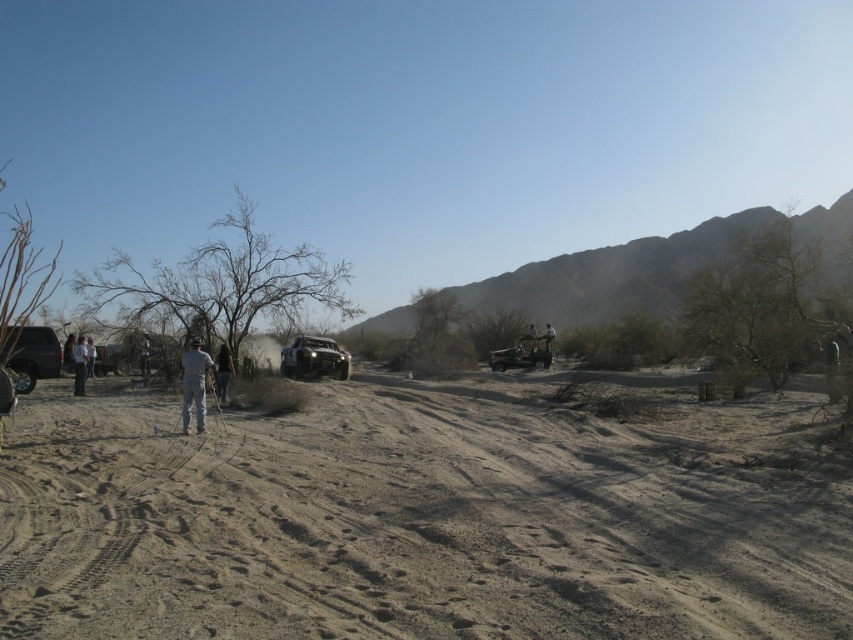
Question: Does gray fabric pants at left appear on the right side of white fabric pants at center?

Choices:
 (A) no
 (B) yes

Answer: (A)

Question: Estimate the real-world distances between objects in this image. Which object is farther from the dull brown dirt at center?

Choices:
 (A) matte silver jeep at center
 (B) green fabric shirt at right
 (C) gray cotton shirt at center

Answer: (A)

Question: Which object is farther from the camera taking this photo?

Choices:
 (A) dull brown dirt at center
 (B) white fabric camera at center
 (C) gray cotton shirt at center
 (D) green fabric shirt at right

Answer: (B)

Question: Is the position of dull brown dirt at center more distant than that of matte black truck at left?

Choices:
 (A) no
 (B) yes

Answer: (A)

Question: Is matte black truck at left to the left of light blue jeans at center from the viewer's perspective?

Choices:
 (A) yes
 (B) no

Answer: (A)

Question: Which of the following is the closest to the observer?

Choices:
 (A) matte black truck at left
 (B) dark gray fabric person at center
 (C) metallic silver jeep at center

Answer: (A)